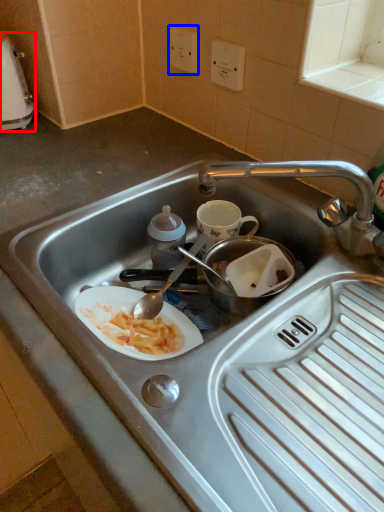
Question: Which of the following is the closest to the observer, appliance (highlighted by a red box) or electric outlet (highlighted by a blue box)?

Choices:
 (A) appliance
 (B) electric outlet

Answer: (A)